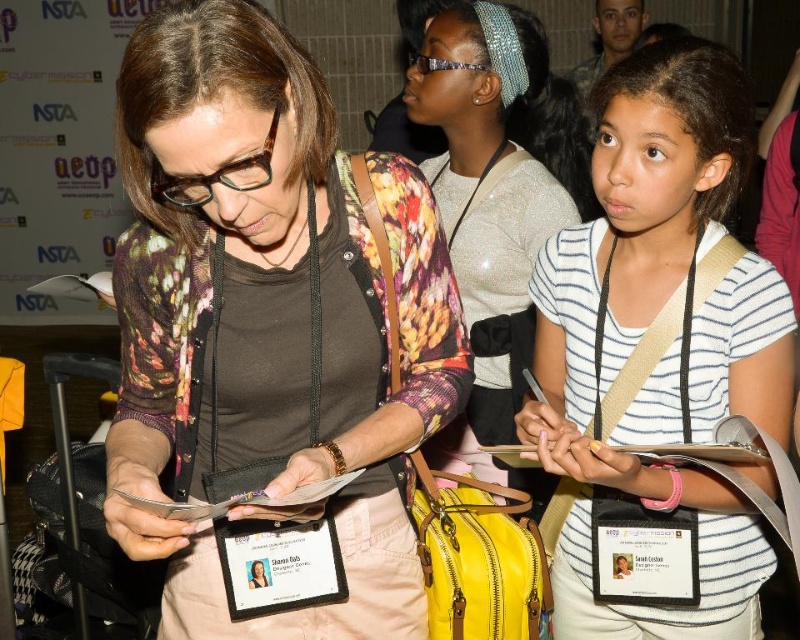
Question: Which object is positioned farthest from the white striped shirt at center?

Choices:
 (A) floral cardigan at center
 (B) sparkly silver headband at upper center

Answer: (B)

Question: Is floral cardigan at center to the right of sparkly silver headband at upper center from the viewer's perspective?

Choices:
 (A) no
 (B) yes

Answer: (A)

Question: Does white striped shirt at center appear on the right side of sparkly silver headband at upper center?

Choices:
 (A) no
 (B) yes

Answer: (B)

Question: Is white striped shirt at center bigger than sparkly silver headband at upper center?

Choices:
 (A) no
 (B) yes

Answer: (A)

Question: Which point is farther to the camera?

Choices:
 (A) (500, 131)
 (B) (404, 304)

Answer: (A)

Question: Which object is closer to the camera taking this photo?

Choices:
 (A) white striped shirt at center
 (B) floral cardigan at center

Answer: (B)